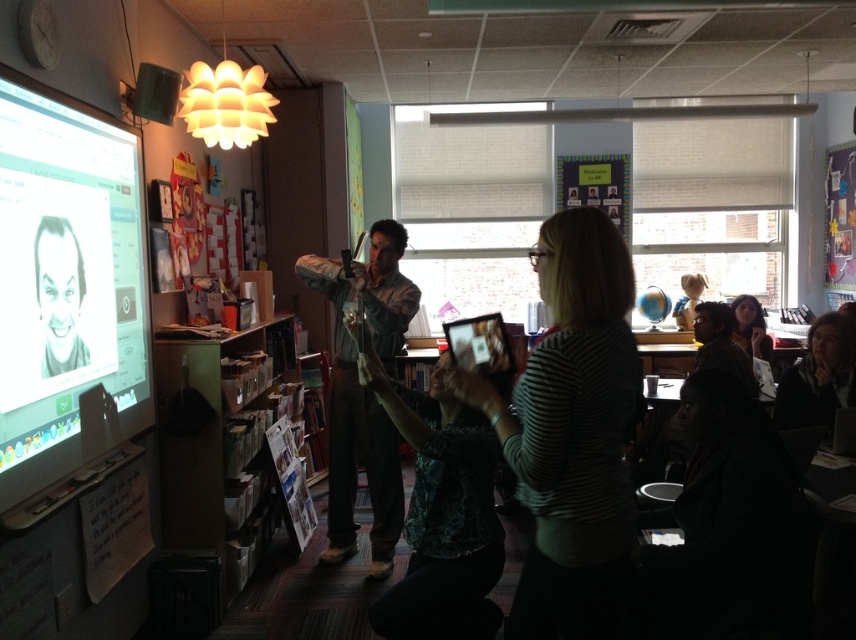
Question: Can you confirm if striped fabric shirt at center is positioned to the left of wooden bookshelf at lower left?

Choices:
 (A) no
 (B) yes

Answer: (A)

Question: Among these points, which one is farthest from the camera?

Choices:
 (A) (749, 349)
 (B) (195, 436)

Answer: (A)

Question: In this image, where is wooden bookshelf at lower left located relative to matte black hair at upper right?

Choices:
 (A) below
 (B) above

Answer: (A)

Question: Which of the following is the farthest from the observer?

Choices:
 (A) (187, 397)
 (B) (539, 556)
 (C) (103, 266)

Answer: (A)

Question: Which of these objects is positioned closest to the wooden bookshelf at lower left?

Choices:
 (A) matte black hair at upper right
 (B) white glossy screen at left
 (C) striped fabric shirt at center

Answer: (B)

Question: Does white glossy screen at left appear on the right side of striped fabric shirt at center?

Choices:
 (A) yes
 (B) no

Answer: (B)